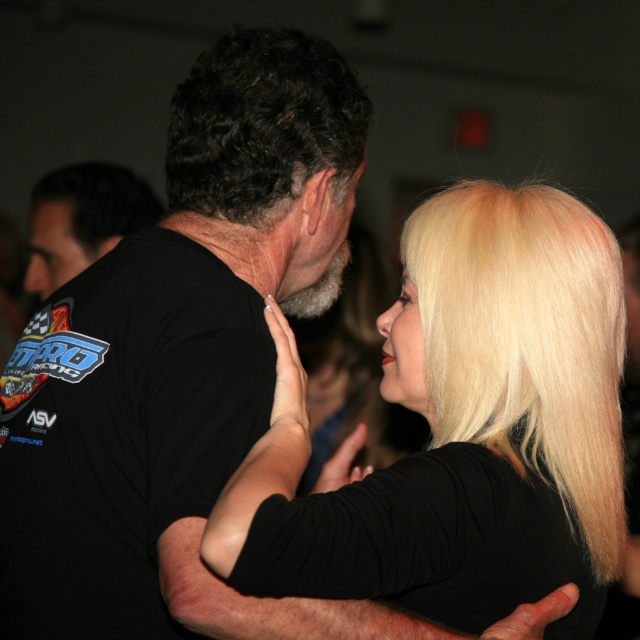
You are a photographer standing at the center of the frame. You want to focus on the point that is closer to you. Which point should you choose between point (x=426, y=209) and point (x=96, y=168)?

Point (x=426, y=209) is in front of point (x=96, y=168), so you should focus on point (x=426, y=209) since it is closer to you.

You are a photographer adjusting the focus on your camera. The two subjects in the frame are the blonde hair at upper right and the dark curly hair at upper center. If your camera can only focus on one subject at a time, which subject should you focus on to ensure the closest subject is sharp?

The dark curly hair at upper center is closer to the camera than the blonde hair at upper right, so you should focus on the dark curly hair at upper center to ensure the closest subject is sharp.

You are a photographer adjusting the lighting for a portrait. You notice two strands of hair in the scene, the blonde hair at upper right and the blonde silky hair at right. Which strand of hair is bigger in size?

The blonde hair at upper right is larger in size compared to the blonde silky hair at right.